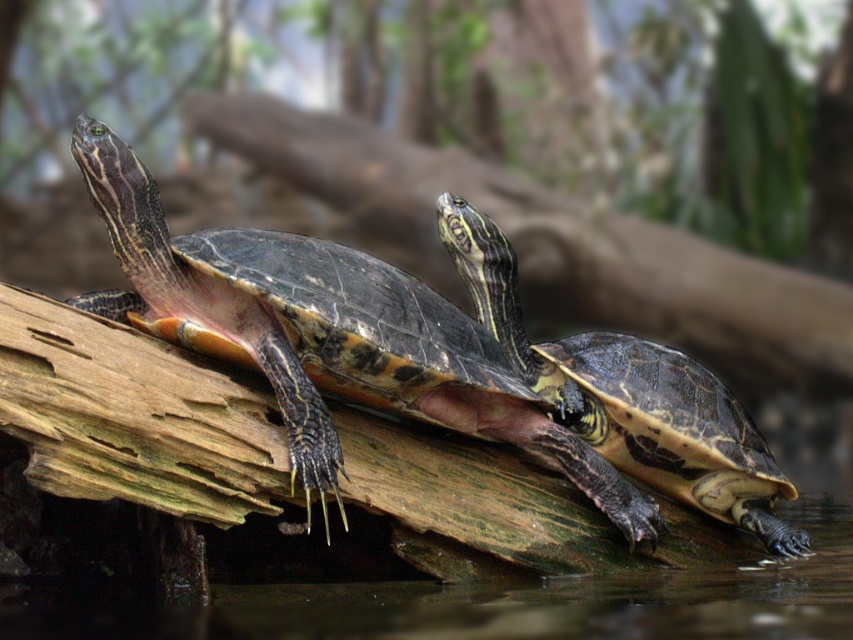
Does shiny black turtle at left appear on the left side of shiny black turtle at center?

Yes, shiny black turtle at left is to the left of shiny black turtle at center.

Who is lower down, shiny black turtle at left or shiny black turtle at center?

shiny black turtle at center is below.

Find the location of a particular element. This screenshot has height=640, width=853. shiny black turtle at left is located at coordinates tap(343, 332).